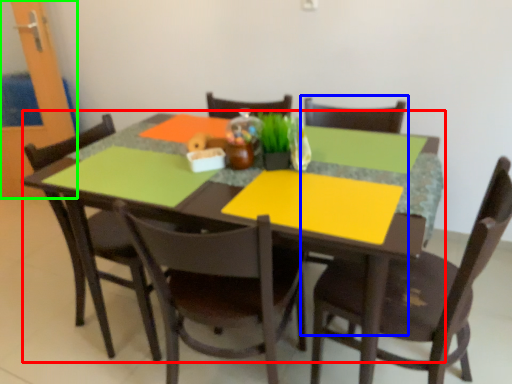
Question: Based on their relative distances, which object is farther from kitchen & dining room table (highlighted by a red box)? Choose from armchair (highlighted by a blue box) and glass door (highlighted by a green box).

Choices:
 (A) armchair
 (B) glass door

Answer: (B)